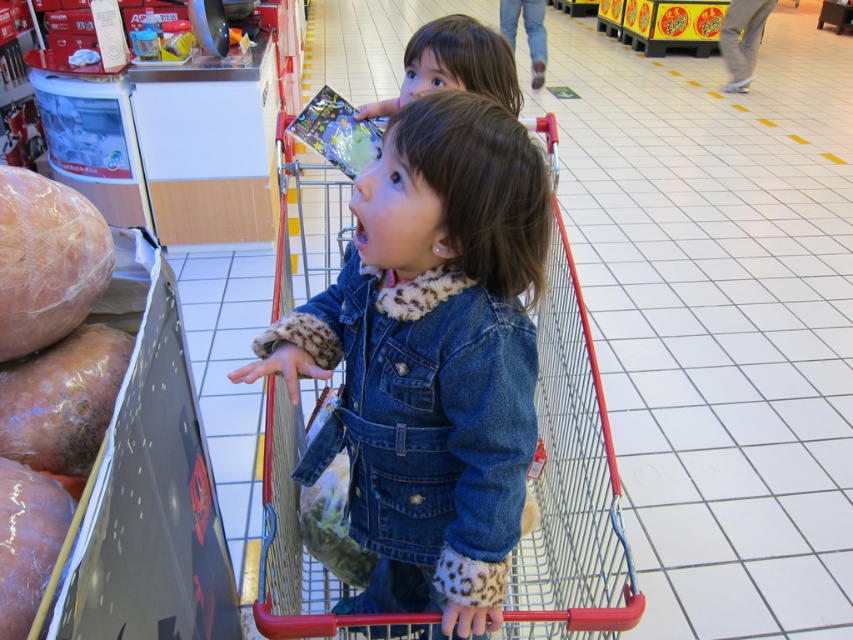
Question: Is metallic red shopping cart at center closer to the viewer compared to denim jacket at lower right?

Choices:
 (A) yes
 (B) no

Answer: (A)

Question: Among these objects, which one is farthest from the camera?

Choices:
 (A) metallic red shopping cart at center
 (B) smooth brown sausage at left

Answer: (A)

Question: Which point is closer to the camera taking this photo?

Choices:
 (A) (10, 257)
 (B) (373, 387)

Answer: (A)

Question: Can you confirm if metallic red shopping cart at center is smaller than smooth brown sausage at left?

Choices:
 (A) yes
 (B) no

Answer: (B)

Question: Which point is farther to the camera?

Choices:
 (A) (440, 499)
 (B) (59, 328)

Answer: (A)

Question: Is metallic red shopping cart at center below smooth brown sausage at left?

Choices:
 (A) no
 (B) yes

Answer: (B)